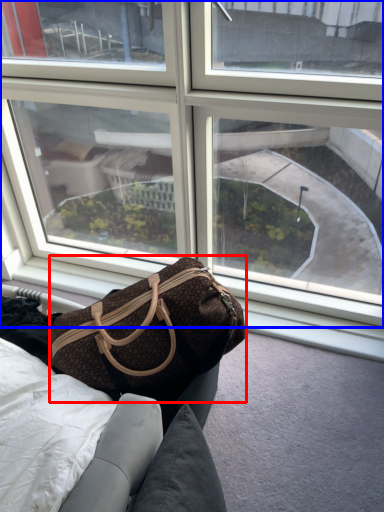
Question: Which object appears farthest to the camera in this image, handbag (highlighted by a red box) or window (highlighted by a blue box)?

Choices:
 (A) handbag
 (B) window

Answer: (B)